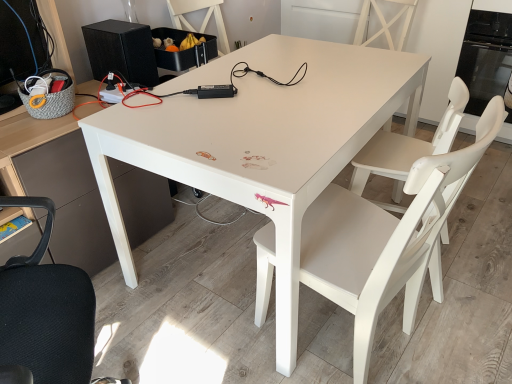
Question: From the image's perspective, would you say white matte chair at center is shown under matte black desk at left?

Choices:
 (A) yes
 (B) no

Answer: (B)

Question: Does white matte chair at center appear on the left side of matte black desk at left?

Choices:
 (A) yes
 (B) no

Answer: (B)

Question: Are white matte chair at center and matte black desk at left located far from each other?

Choices:
 (A) yes
 (B) no

Answer: (A)

Question: Is white matte chair at center looking in the opposite direction of matte black desk at left?

Choices:
 (A) no
 (B) yes

Answer: (A)

Question: Is matte black desk at left completely or partially inside white matte chair at center?

Choices:
 (A) yes
 (B) no

Answer: (B)

Question: From the image's perspective, is white matte chair at center above or below black glass oven at upper right?

Choices:
 (A) above
 (B) below

Answer: (B)

Question: From a real-world perspective, is white matte chair at center physically located above or below black glass oven at upper right?

Choices:
 (A) above
 (B) below

Answer: (B)

Question: Based on their positions, is white matte chair at center located to the left or right of black glass oven at upper right?

Choices:
 (A) right
 (B) left

Answer: (B)

Question: In terms of size, does white matte chair at center appear bigger or smaller than black glass oven at upper right?

Choices:
 (A) big
 (B) small

Answer: (A)

Question: Looking at the image, does matte black desk at left seem bigger or smaller compared to white matte chair at center?

Choices:
 (A) small
 (B) big

Answer: (B)

Question: Considering their positions, is matte black desk at left located in front of or behind white matte chair at center?

Choices:
 (A) behind
 (B) front

Answer: (B)

Question: From a real-world perspective, relative to white matte chair at center, is matte black desk at left vertically above or below?

Choices:
 (A) above
 (B) below

Answer: (A)

Question: Visually, is matte black desk at left positioned to the left or to the right of white matte chair at center?

Choices:
 (A) right
 (B) left

Answer: (B)

Question: Is black matte speaker at upper left to the left or to the right of black glass oven at upper right in the image?

Choices:
 (A) right
 (B) left

Answer: (B)

Question: Does point (126, 34) appear closer or farther from the camera than point (475, 62)?

Choices:
 (A) farther
 (B) closer

Answer: (B)